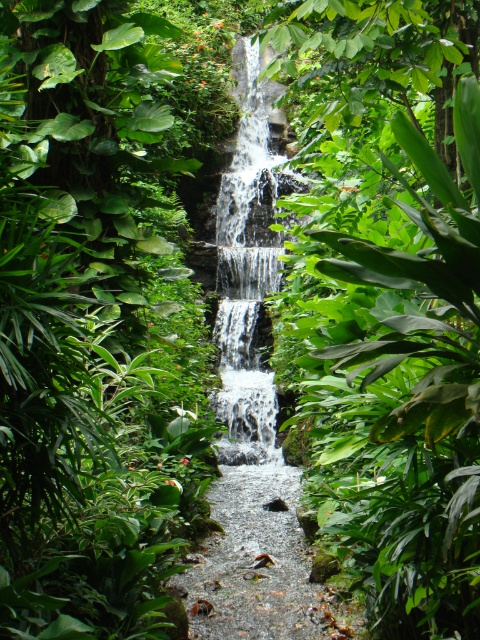
Question: Is smooth gravel path at center bigger than white frothy water at center?

Choices:
 (A) yes
 (B) no

Answer: (B)

Question: Can you confirm if smooth gravel path at center is positioned to the left of white frothy water at center?

Choices:
 (A) yes
 (B) no

Answer: (B)

Question: Which point is farther from the camera taking this photo?

Choices:
 (A) 276,109
 (B) 260,566

Answer: (A)

Question: Does smooth gravel path at center have a smaller size compared to white frothy water at center?

Choices:
 (A) yes
 (B) no

Answer: (A)